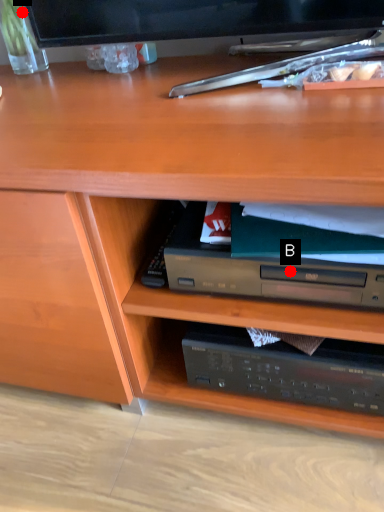
Question: Two points are circled on the image, labeled by A and B beside each circle. Which point is closer to the camera?

Choices:
 (A) A is closer
 (B) B is closer

Answer: (B)